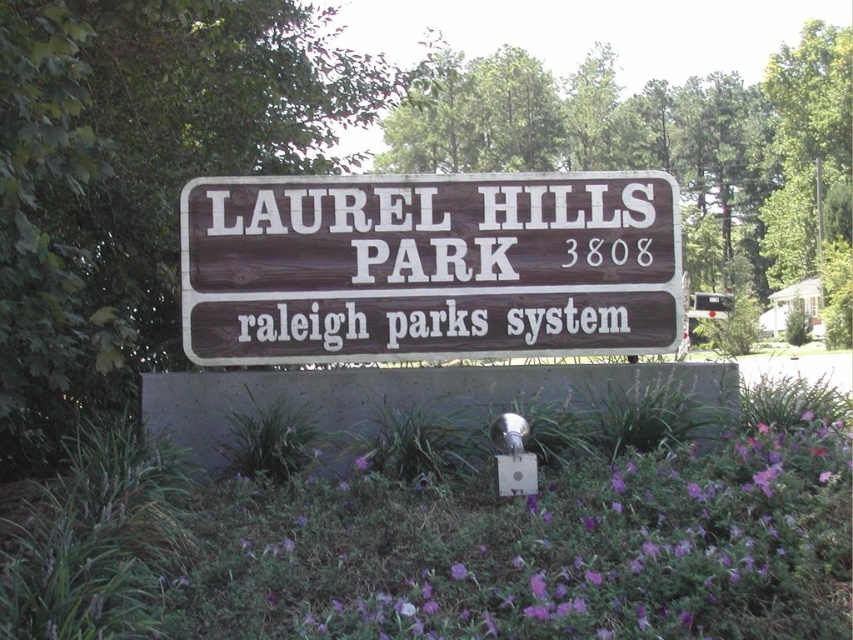
Which of these two, brown wood sign at center or purple matte flower at center, stands shorter?

With less height is purple matte flower at center.

Image resolution: width=853 pixels, height=640 pixels. Describe the element at coordinates (428, 266) in the screenshot. I see `brown wood sign at center` at that location.

You are a GUI agent. You are given a task and a screenshot of the screen. Output one action in this format:
    pyautogui.click(x=<x>, y=<y>)
    Task: Click on the brown wood sign at center
    Image resolution: width=853 pixels, height=640 pixels.
    Given the screenshot: What is the action you would take?
    pyautogui.click(x=428, y=266)